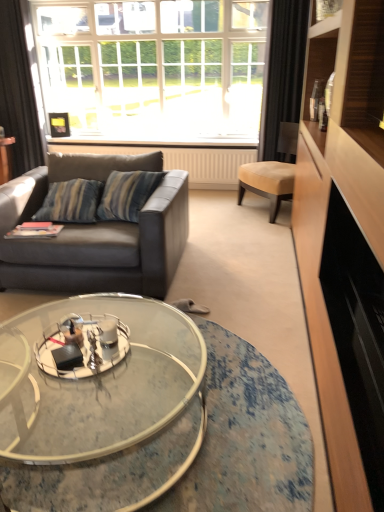
Question: Relative to white textured radiator at center, is suede-like tan chair at right in front or behind?

Choices:
 (A) front
 (B) behind

Answer: (A)

Question: Based on their positions, is suede-like tan chair at right located to the left or right of white textured radiator at center?

Choices:
 (A) left
 (B) right

Answer: (B)

Question: Which object is the closest to the white textured radiator at center?

Choices:
 (A) clear glass window at upper center
 (B) suede-like tan chair at right
 (C) wooden cabinet at right
 (D) dark gray fabric curtain at left, marked as the 1th curtain in a left-to-right arrangement
 (E) matte gray leather couch at left

Answer: (B)

Question: Which is nearer to the wooden cabinet at right?

Choices:
 (A) white textured radiator at center
 (B) black fabric curtain at upper right, which is the 2th curtain from left to right
 (C) dark gray fabric curtain at left, marked as the 1th curtain in a left-to-right arrangement
 (D) matte gray leather couch at left
 (E) clear glass window at upper center

Answer: (D)